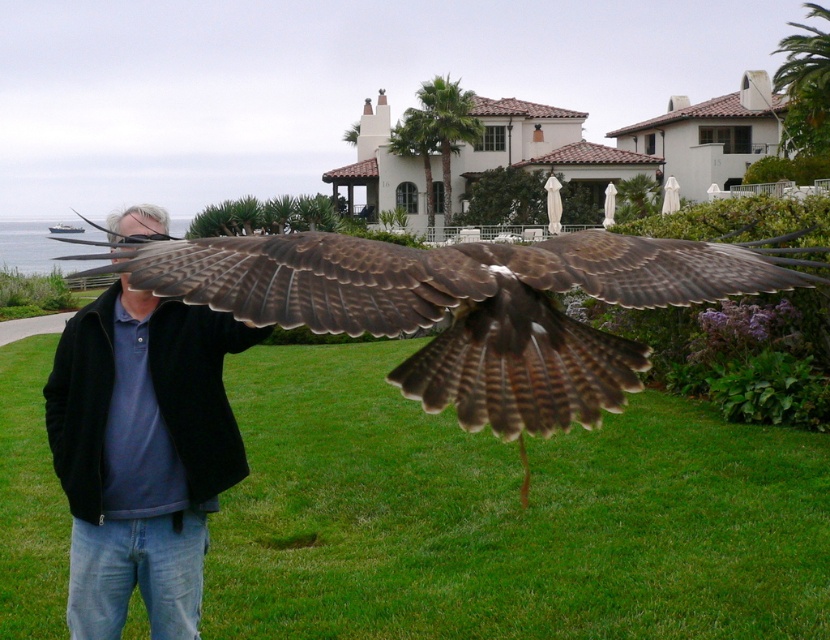
You are a wildlife photographer aiming to capture the brown feathered falcon at center and the blue cotton shirt at center in the same frame. Based on their sizes, which object would appear smaller in your photo?

The brown feathered falcon at center is not as tall as the blue cotton shirt at center, so it would appear smaller in the photo.

You are a wildlife photographer aiming to capture a closeup shot of the brown feathered falcon at center. Your camera has a minimum focusing distance of 10 feet. Can you take the photo without moving closer?

The brown feathered falcon at center is 9.68 feet away from camera, which is within the minimum focusing distance of 10 feet. Therefore, you can take the closeup shot without moving closer.